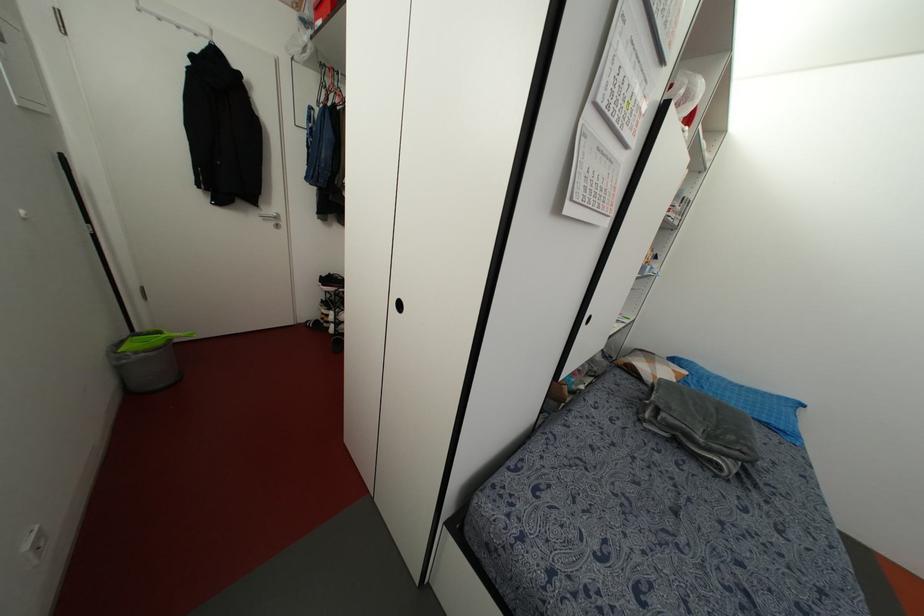
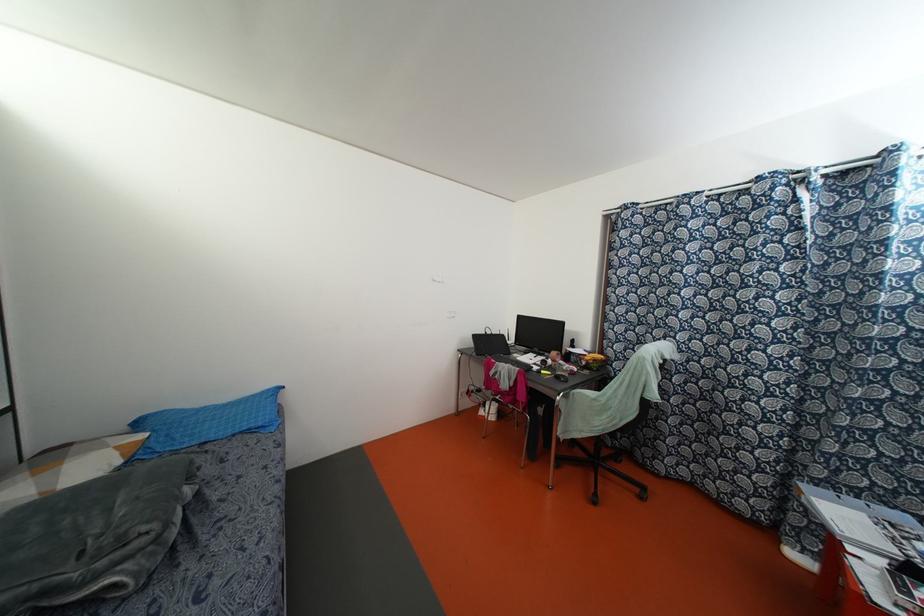
Locate, in the second image, the point that corresponds to the point at 782,427 in the first image.

(259, 424)